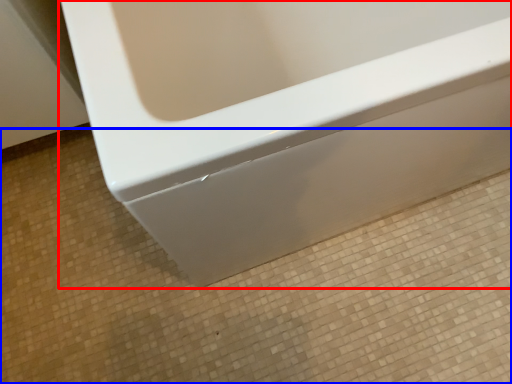
Question: Which point is further to the camera, bathtub (highlighted by a red box) or ceramic tile (highlighted by a blue box)?

Choices:
 (A) bathtub
 (B) ceramic tile

Answer: (B)